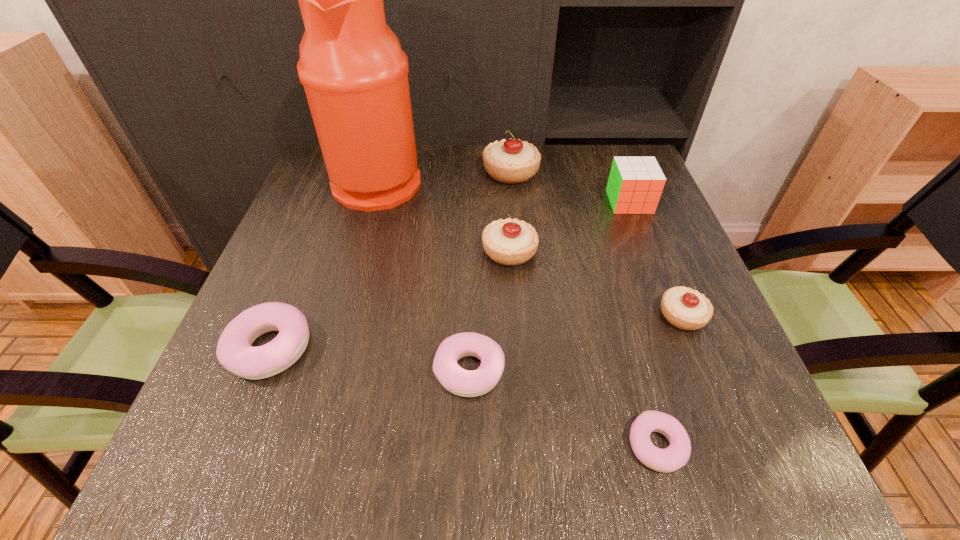
Where is `object situated at the far left corner`? This screenshot has width=960, height=540. object situated at the far left corner is located at coordinates (355, 74).

At what (x,y) coordinates should I click in order to perform the action: click on object located at the far right corner. Please return your answer as a coordinate pair (x, y). Looking at the image, I should click on (635, 185).

This screenshot has height=540, width=960. What are the coordinates of `object that is at the near right corner` in the screenshot? It's located at (676, 455).

At what (x,y) coordinates should I click in order to perform the action: click on free space at the near edge of the desktop. Please return your answer as a coordinate pair (x, y). This screenshot has height=540, width=960. Looking at the image, I should click on (470, 453).

This screenshot has height=540, width=960. In the image, there is a desktop. In order to click on vacant space at the left edge in this screenshot , I will do `click(305, 196)`.

Image resolution: width=960 pixels, height=540 pixels. Identify the location of free space at the right edge. (x=621, y=266).

Image resolution: width=960 pixels, height=540 pixels. I want to click on free space at the far right corner of the desktop, so click(602, 193).

Find the location of a particular element. free space between the fourth farthest object and the nearest pastry is located at coordinates (583, 349).

Locate an element on the screen. The image size is (960, 540). empty space that is in between the second smallest pink pastry and the smallest pink pastry is located at coordinates tap(563, 408).

This screenshot has width=960, height=540. Find the location of `free space that is in between the nearest beige pastry and the fifth nearest object`. free space that is in between the nearest beige pastry and the fifth nearest object is located at coordinates (596, 284).